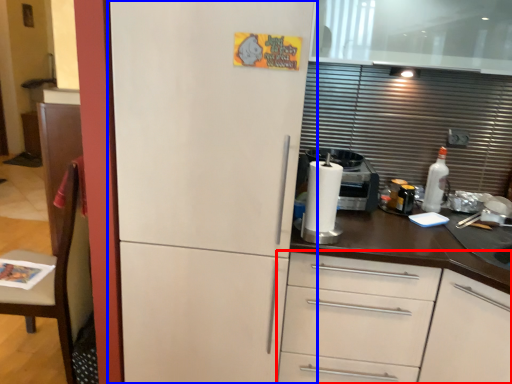
Question: Which of the following is the farthest to the observer, cabinetry (highlighted by a red box) or refrigerator (highlighted by a blue box)?

Choices:
 (A) cabinetry
 (B) refrigerator

Answer: (A)